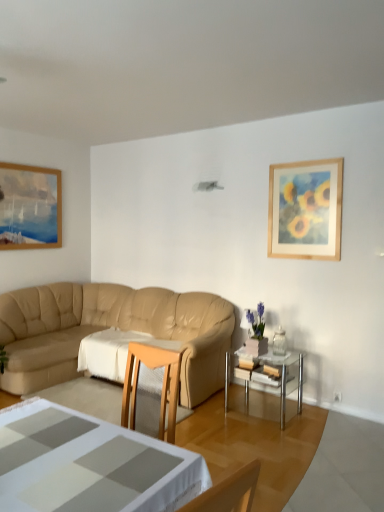
Question: From a real-world perspective, is wooden framed painting at upper right physically located above or below white fabric tablecloth at center?

Choices:
 (A) above
 (B) below

Answer: (A)

Question: From the image's perspective, relative to white fabric tablecloth at center, is wooden framed painting at upper right above or below?

Choices:
 (A) above
 (B) below

Answer: (A)

Question: Estimate the real-world distances between objects in this image. Which object is farther from the wooden framed painting at upper right?

Choices:
 (A) matte pink vase at right
 (B) white glossy coffee table at lower center
 (C) clear glass table at center
 (D) white fabric tablecloth at center
 (E) beige leather couch at center

Answer: (B)

Question: Based on their relative distances, which object is nearer to the matte pink vase at right?

Choices:
 (A) clear glass table at center
 (B) white fabric tablecloth at center
 (C) wooden framed painting at upper right
 (D) beige leather couch at center
 (E) white glossy coffee table at lower center

Answer: (A)